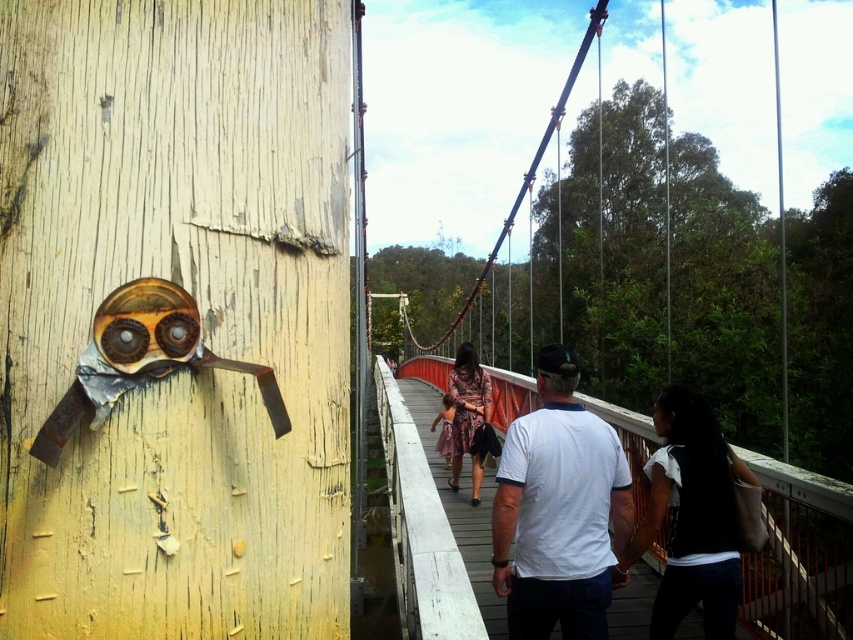
Is white cotton shirt at center thinner than floral dress at center?

No, white cotton shirt at center is not thinner than floral dress at center.

Which is behind, point (602, 426) or point (473, 428)?

Positioned behind is point (473, 428).

The width and height of the screenshot is (853, 640). Find the location of `white cotton shirt at center`. white cotton shirt at center is located at coordinates (560, 512).